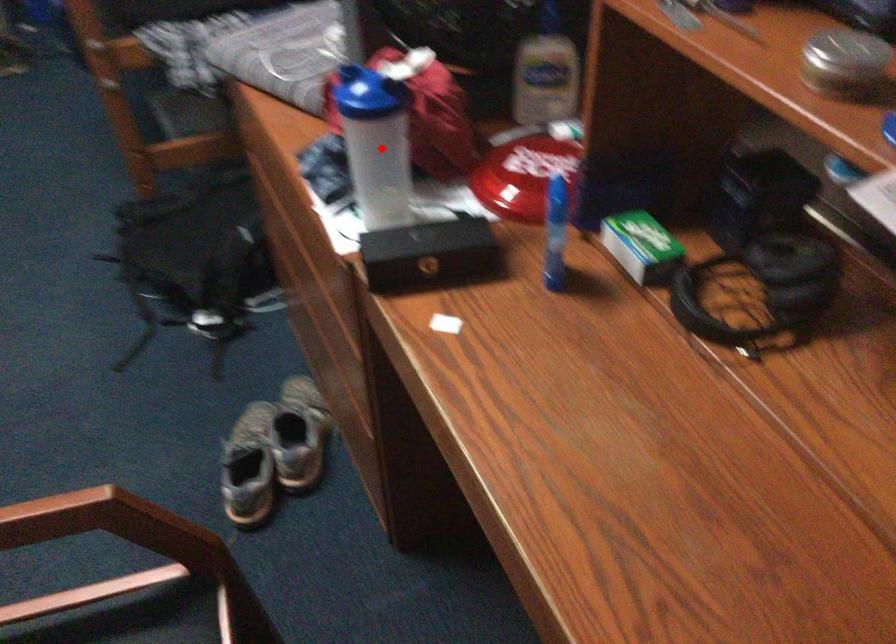
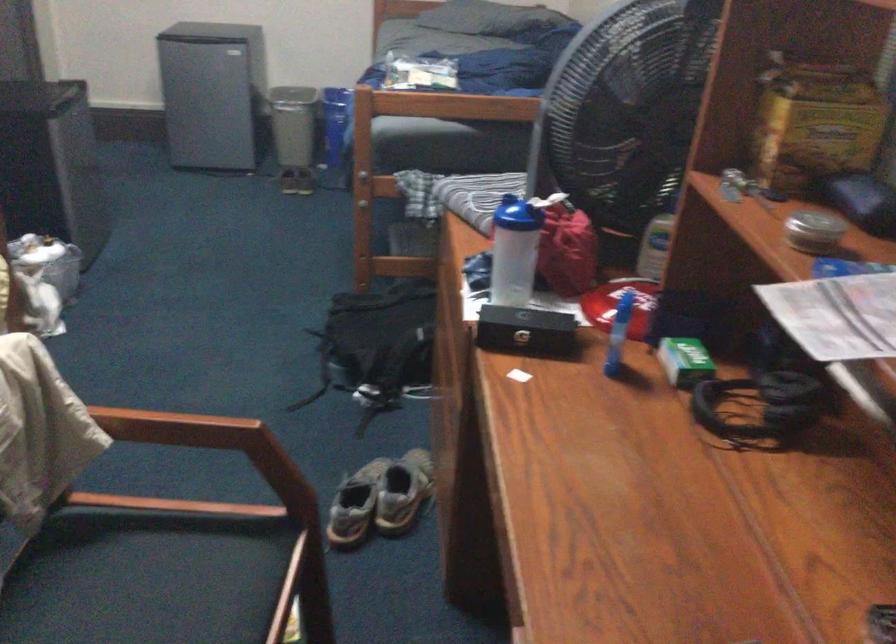
Question: A red point is marked in image1. In image2, is the corresponding 3D point closer to the camera or farther? Reply with the corresponding letter.

Choices:
 (A) The corresponding 3D point is closer.
 (B) The corresponding 3D point is farther.

Answer: (B)